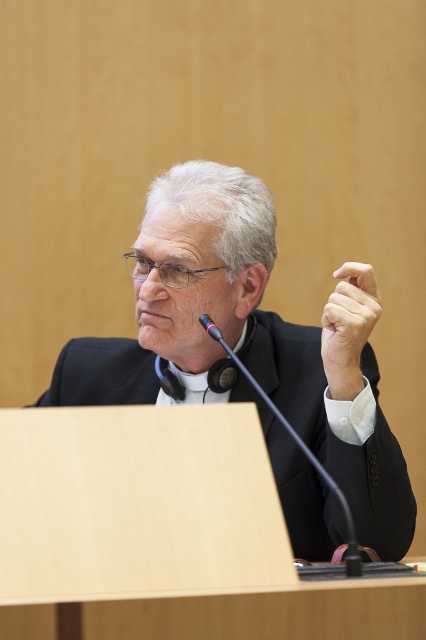
Question: Does black matte suit at center have a greater width compared to smooth skin hand at center?

Choices:
 (A) no
 (B) yes

Answer: (B)

Question: Which point is farther to the camera?

Choices:
 (A) (290, 420)
 (B) (350, 292)

Answer: (A)

Question: Is black matte suit at center to the left of smooth skin hand at center from the viewer's perspective?

Choices:
 (A) yes
 (B) no

Answer: (A)

Question: Which point appears farthest from the camera in this image?

Choices:
 (A) (57, 392)
 (B) (371, 298)

Answer: (A)

Question: Can you confirm if black matte suit at center is positioned to the right of smooth skin hand at center?

Choices:
 (A) yes
 (B) no

Answer: (B)